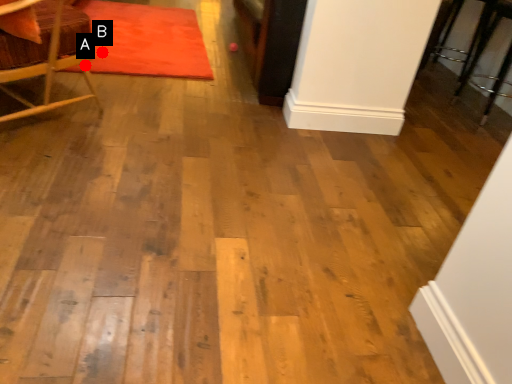
Question: Two points are circled on the image, labeled by A and B beside each circle. Which of the following is the closest to the observer?

Choices:
 (A) A is closer
 (B) B is closer

Answer: (A)